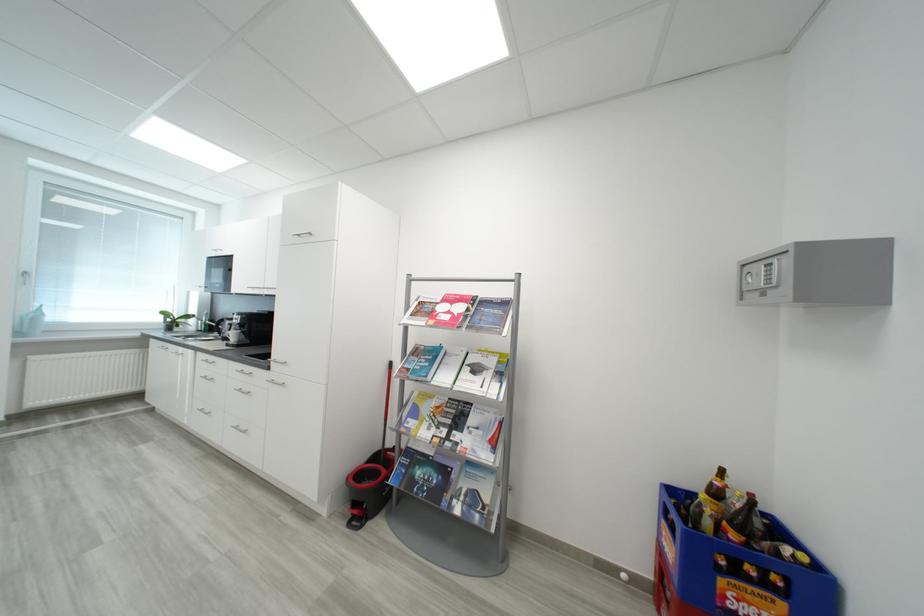
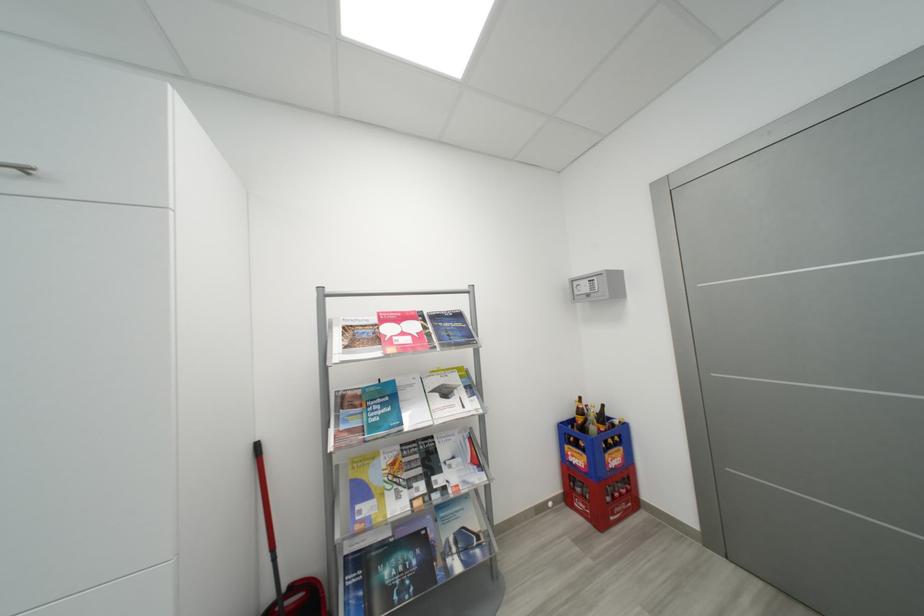
Question: The camera is either moving clockwise (left) or counter-clockwise (right) around the object. The first image is from the beginning of the video and the second image is from the end. Is the camera moving left or right when shooting the video?

Choices:
 (A) Left
 (B) Right

Answer: (A)